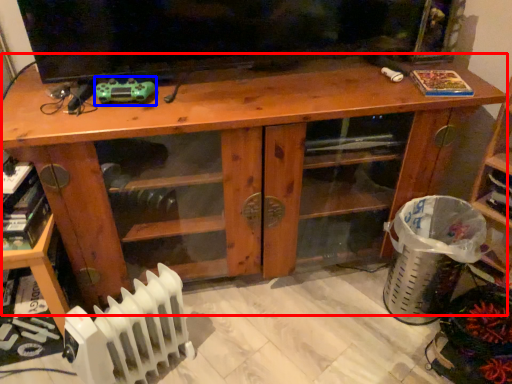
Question: Which point is further to the camera, desk (highlighted by a red box) or toy (highlighted by a blue box)?

Choices:
 (A) desk
 (B) toy

Answer: (B)